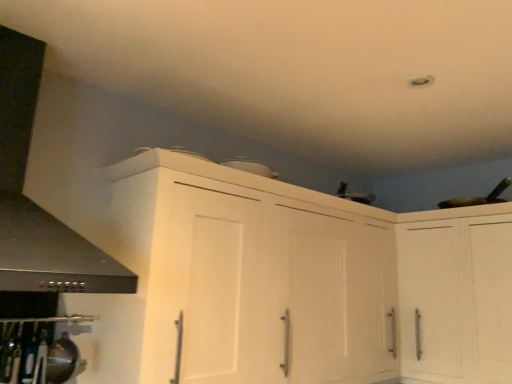
Question: Is point (101, 274) closer or farther from the camera than point (400, 360)?

Choices:
 (A) farther
 (B) closer

Answer: (B)

Question: From the image's perspective, is black matte exhaust hood at left above or below white matte cabinet at upper right, which ranks as the second cabinetry in left-to-right order?

Choices:
 (A) above
 (B) below

Answer: (A)

Question: Which of these objects is positioned closest to the white matte cabinet at upper right, the 1th cabinetry positioned from the right?

Choices:
 (A) white matte cabinet at upper center, the first cabinetry in the left-to-right sequence
 (B) black matte exhaust hood at left

Answer: (A)

Question: Which is nearer to the white matte cabinet at upper center, which ranks as the 2th cabinetry in right-to-left order?

Choices:
 (A) white matte cabinet at upper right, the 1th cabinetry positioned from the right
 (B) black matte exhaust hood at left

Answer: (A)